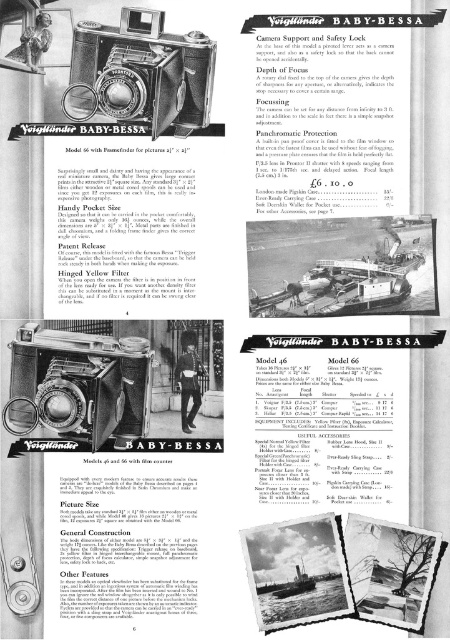
You are examining the vintage advertisement layout. The metallic silver camera at center is positioned at coordinates. Can you determine its exact location in the image?

The metallic silver camera at center is located at point (79, 381).

You are examining the vintage advertisement for the Voigtlander Baby Bessa camera models 46 and 66. You notice two cameras displayed at the center of the top section. Which camera, the metallic silver camera at center or the matte black camera at center, has a greater height?

The metallic silver camera at center is taller than the matte black camera at center.